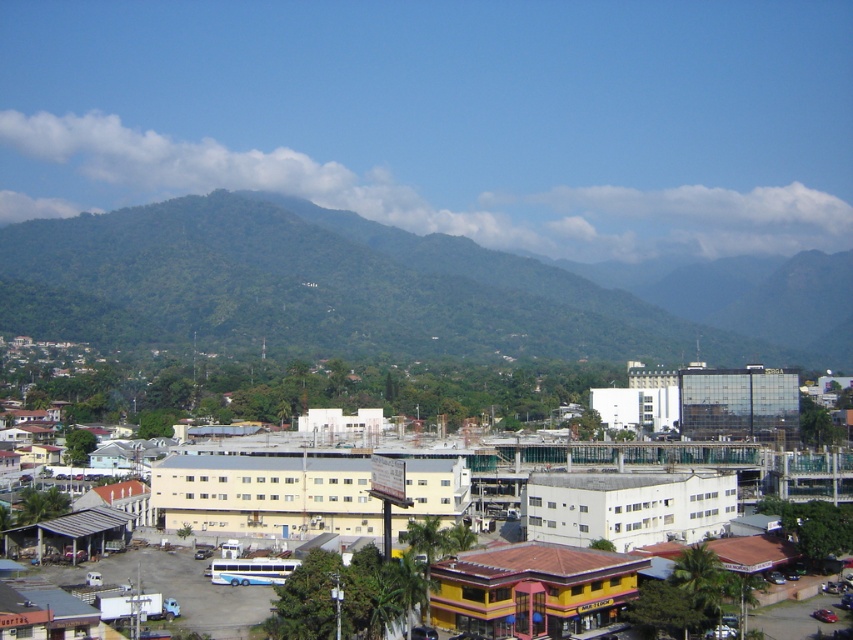
Question: From the image, what is the correct spatial relationship of green leafy mountain at center in relation to white matte building at center?

Choices:
 (A) above
 (B) below

Answer: (A)

Question: Can you confirm if green leafy mountain at center is positioned above white matte building at center?

Choices:
 (A) no
 (B) yes

Answer: (B)

Question: Is green leafy mountain at center positioned before white matte building at center?

Choices:
 (A) no
 (B) yes

Answer: (A)